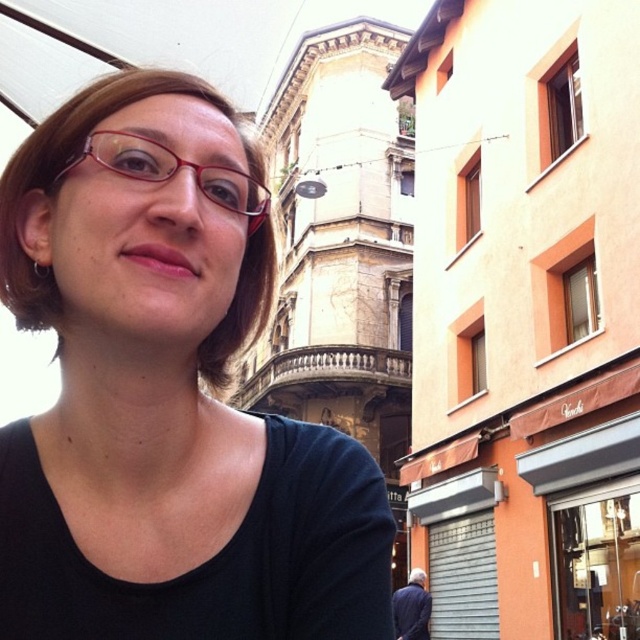
You are a photographer adjusting the focus on your camera. You want to capture both the matte black shirt at center and the matte red glasses at center in sharp focus. The depth of field allows for objects within 3 meters to be in focus. Will both objects be in focus?

The matte black shirt at center is 3.29 meters from the matte red glasses at center. Since the depth of field only covers objects within 3 meters, the distance between them exceeds the allowable range. Therefore, both objects cannot be in focus simultaneously.

You are a photographer standing at the scene. You want to take a portrait of the person wearing the matte black shirt at center. Considering the distance, can you clearly capture facial details without using a zoom lens?

The matte black shirt at center is 43.89 feet away from the camera. Without a zoom lens, capturing clear facial details at this distance may be challenging due to the limited focal length of standard lenses.

You are a photographer trying to focus on the matte black shirt at center and the dark blue fabric at lower right. Which object is closer to the camera?

The matte black shirt at center is closer to the camera because it is in front of the dark blue fabric at lower right.